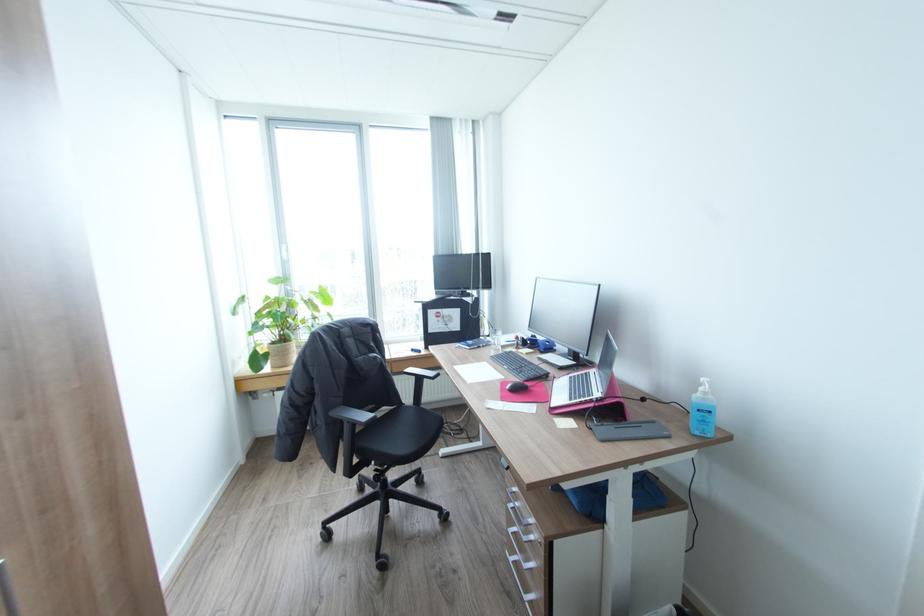
Find where to push the sanitizer bottle pump. Please return your answer as a coordinate pair (x, y).

(702, 411)